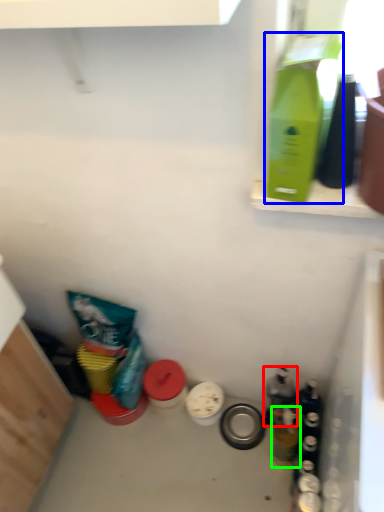
Question: Which object is positioned closest to bottle (highlighted by a red box)? Select from bottle (highlighted by a blue box) and bottle (highlighted by a green box).

Choices:
 (A) bottle
 (B) bottle

Answer: (B)